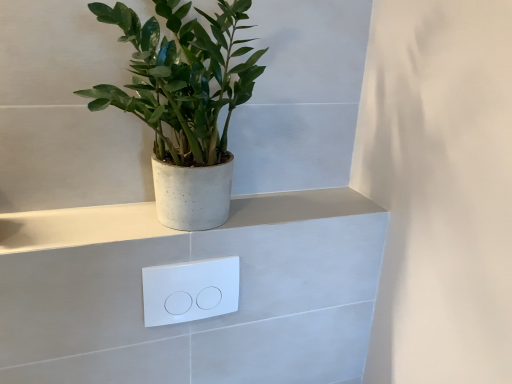
Question: Is green matte plant at upper left at the left side of white concrete ledge at upper center?

Choices:
 (A) no
 (B) yes

Answer: (B)

Question: Is green matte plant at upper left shorter than white concrete ledge at upper center?

Choices:
 (A) yes
 (B) no

Answer: (B)

Question: Does green matte plant at upper left have a greater height compared to white concrete ledge at upper center?

Choices:
 (A) no
 (B) yes

Answer: (B)

Question: Is green matte plant at upper left not within white concrete ledge at upper center?

Choices:
 (A) yes
 (B) no

Answer: (A)

Question: Does green matte plant at upper left have a lesser width compared to white concrete ledge at upper center?

Choices:
 (A) yes
 (B) no

Answer: (B)

Question: Is green matte plant at upper left taller or shorter than white glossy/light switch at center?

Choices:
 (A) short
 (B) tall

Answer: (B)

Question: Is green matte plant at upper left to the left or to the right of white glossy/light switch at center in the image?

Choices:
 (A) right
 (B) left

Answer: (B)

Question: Is green matte plant at upper left wider or thinner than white glossy/light switch at center?

Choices:
 (A) thin
 (B) wide

Answer: (B)

Question: Considering their positions, is green matte plant at upper left located in front of or behind white glossy/light switch at center?

Choices:
 (A) behind
 (B) front

Answer: (B)

Question: From the image's perspective, is white glossy/light switch at center positioned above or below green matte plant at upper left?

Choices:
 (A) above
 (B) below

Answer: (B)

Question: Considering the positions of white glossy/light switch at center and green matte plant at upper left in the image, is white glossy/light switch at center wider or thinner than green matte plant at upper left?

Choices:
 (A) thin
 (B) wide

Answer: (A)

Question: Considering the positions of point (225, 286) and point (195, 71), is point (225, 286) closer or farther from the camera than point (195, 71)?

Choices:
 (A) farther
 (B) closer

Answer: (A)

Question: Considering the positions of white glossy/light switch at center and green matte plant at upper left in the image, is white glossy/light switch at center taller or shorter than green matte plant at upper left?

Choices:
 (A) short
 (B) tall

Answer: (A)

Question: Is point (165, 312) positioned closer to the camera than point (105, 226)?

Choices:
 (A) farther
 (B) closer

Answer: (A)

Question: Which is correct: white glossy/light switch at center is inside white concrete ledge at upper center, or outside of it?

Choices:
 (A) outside
 (B) inside

Answer: (A)